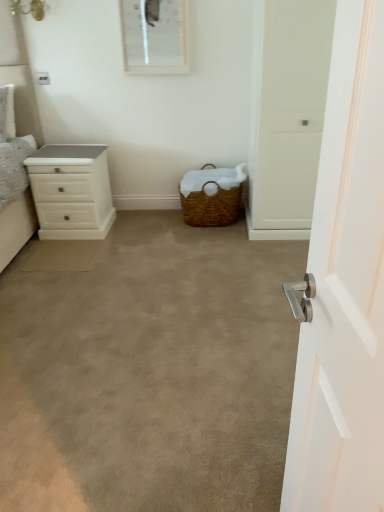
Question: Are white glossy picture frame at upper center and woven brown picnic basket at center located far from each other?

Choices:
 (A) yes
 (B) no

Answer: (B)

Question: Would you say woven brown picnic basket at center is part of white glossy picture frame at upper center's contents?

Choices:
 (A) yes
 (B) no

Answer: (B)

Question: Does white glossy picture frame at upper center have a larger size compared to woven brown picnic basket at center?

Choices:
 (A) yes
 (B) no

Answer: (B)

Question: Is white glossy picture frame at upper center oriented away from woven brown picnic basket at center?

Choices:
 (A) no
 (B) yes

Answer: (A)

Question: Is white glossy picture frame at upper center thinner than woven brown picnic basket at center?

Choices:
 (A) yes
 (B) no

Answer: (A)

Question: Considering the positions of white glossy chest of drawers at left and white matte door handle at right in the image, is white glossy chest of drawers at left taller or shorter than white matte door handle at right?

Choices:
 (A) tall
 (B) short

Answer: (B)

Question: Is point (104, 167) positioned closer to the camera than point (347, 395)?

Choices:
 (A) farther
 (B) closer

Answer: (A)

Question: Visually, is white glossy chest of drawers at left positioned to the left or to the right of white matte door handle at right?

Choices:
 (A) right
 (B) left

Answer: (B)

Question: From the image's perspective, is white glossy chest of drawers at left positioned above or below white matte door handle at right?

Choices:
 (A) above
 (B) below

Answer: (A)

Question: Is white glossy picture frame at upper center situated inside woven brown picnic basket at center or outside?

Choices:
 (A) inside
 (B) outside

Answer: (B)

Question: Based on their sizes in the image, would you say white glossy picture frame at upper center is bigger or smaller than woven brown picnic basket at center?

Choices:
 (A) big
 (B) small

Answer: (B)

Question: Considering the positions of white glossy picture frame at upper center and woven brown picnic basket at center in the image, is white glossy picture frame at upper center taller or shorter than woven brown picnic basket at center?

Choices:
 (A) short
 (B) tall

Answer: (B)

Question: Relative to woven brown picnic basket at center, is white glossy picture frame at upper center in front or behind?

Choices:
 (A) behind
 (B) front

Answer: (B)

Question: Is beige carpet at center wider or thinner than white matte door handle at right?

Choices:
 (A) thin
 (B) wide

Answer: (B)

Question: Do you think beige carpet at center is within white matte door handle at right, or outside of it?

Choices:
 (A) inside
 (B) outside

Answer: (B)